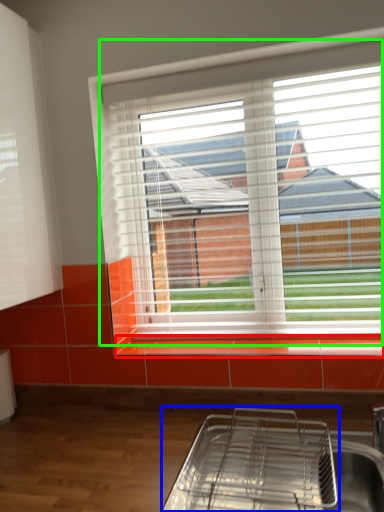
Question: Which object is positioned farthest from window sill (highlighted by a red box)? Select from appliance (highlighted by a blue box) and window (highlighted by a green box).

Choices:
 (A) appliance
 (B) window

Answer: (B)